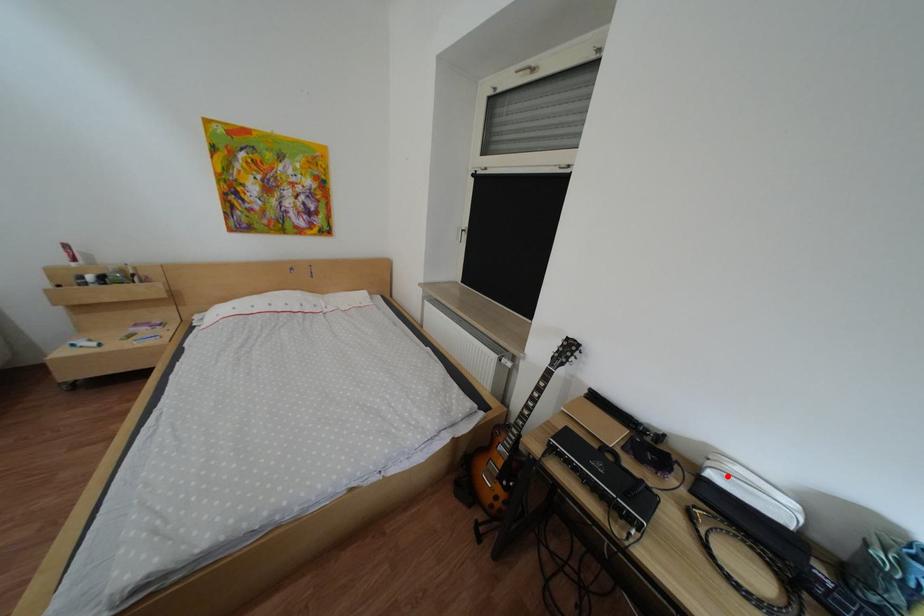
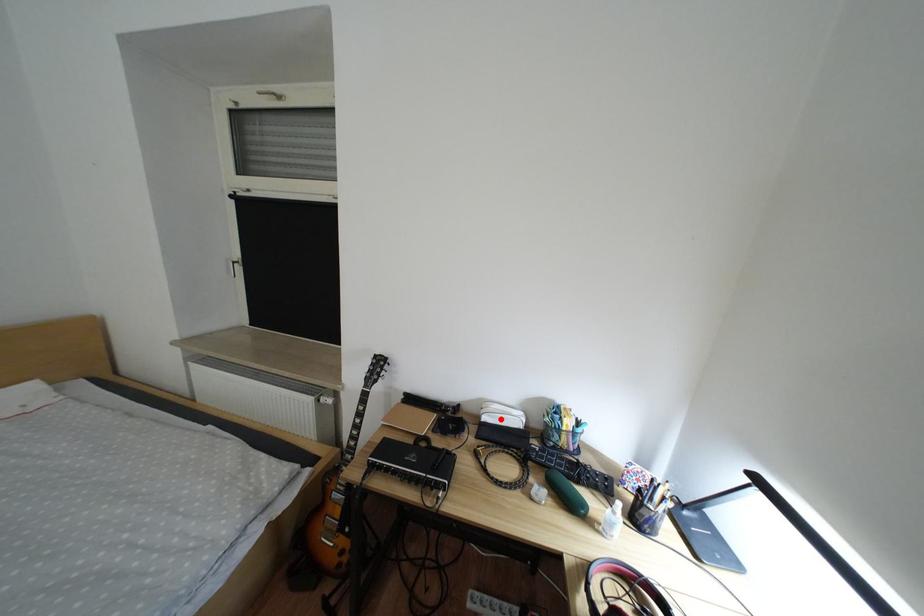
I am providing you with two images of the same scene from different viewpoints. A red point is marked on the first image and another point is marked on the second image. Are the points marked in image1 and image2 representing the same 3D position?

Yes